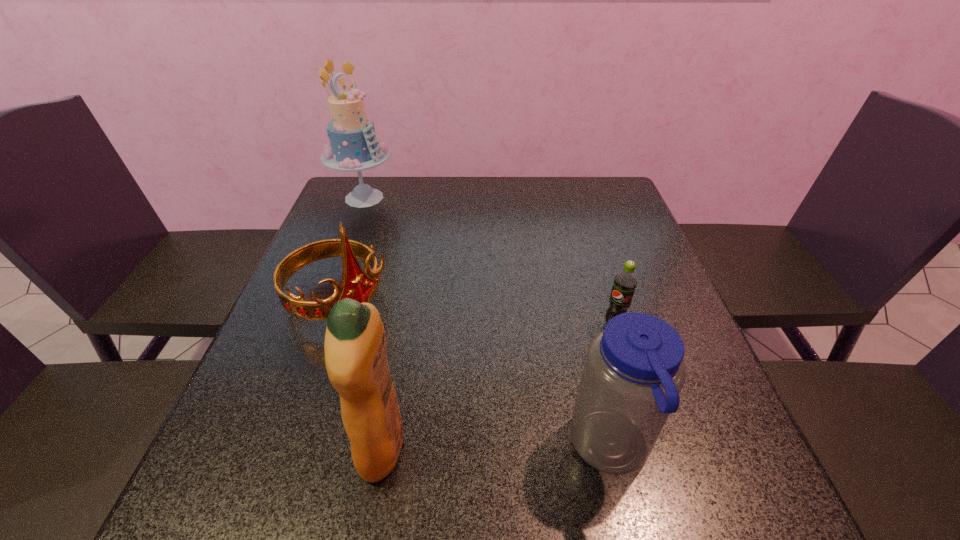
Image resolution: width=960 pixels, height=540 pixels. Find the location of `free space located 0.340m with a carrying loop on the side of the water bottle`. free space located 0.340m with a carrying loop on the side of the water bottle is located at coordinates (369, 449).

You are a GUI agent. You are given a task and a screenshot of the screen. Output one action in this format:
    pyautogui.click(x=<x>, y=<y>)
    Task: Click on the vacant region located 0.240m with a carrying loop on the side of the water bottle
    This screenshot has width=960, height=540.
    Given the screenshot: What is the action you would take?
    pyautogui.click(x=428, y=449)

Where is `vacant space located 0.130m with a carrying loop on the side of the water bottle`? The width and height of the screenshot is (960, 540). vacant space located 0.130m with a carrying loop on the side of the water bottle is located at coordinates (493, 449).

Where is `vacant space situated 0.090m with a ladder on the side of the cake`? This screenshot has width=960, height=540. vacant space situated 0.090m with a ladder on the side of the cake is located at coordinates (384, 229).

Find the location of `free space located 0.150m with a ladder on the side of the cake`. free space located 0.150m with a ladder on the side of the cake is located at coordinates (391, 240).

In order to click on free space located 0.190m with a ladder on the side of the cake in this screenshot , I will do `click(396, 248)`.

Where is `free space located on the front label of the soda`? The height and width of the screenshot is (540, 960). free space located on the front label of the soda is located at coordinates (587, 350).

Locate an element on the screen. This screenshot has width=960, height=540. free region located 0.150m on the front label of the soda is located at coordinates (565, 370).

Identify the location of free location located on the front label of the soda. The height and width of the screenshot is (540, 960). (543, 392).

Where is `vacant point located 0.370m on the front-facing side of the tiara`? vacant point located 0.370m on the front-facing side of the tiara is located at coordinates (502, 434).